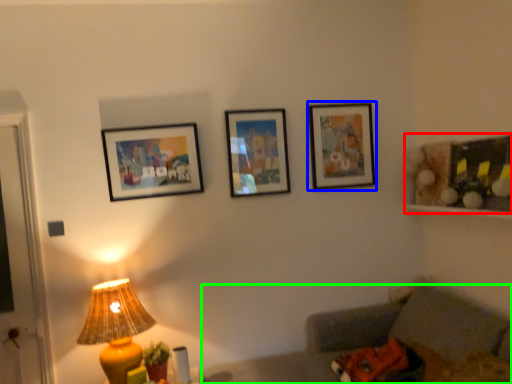
Question: Which object is positioned farthest from decorative picture (highlighted by a red box)? Select from picture frame (highlighted by a blue box) and couch (highlighted by a green box).

Choices:
 (A) picture frame
 (B) couch

Answer: (B)